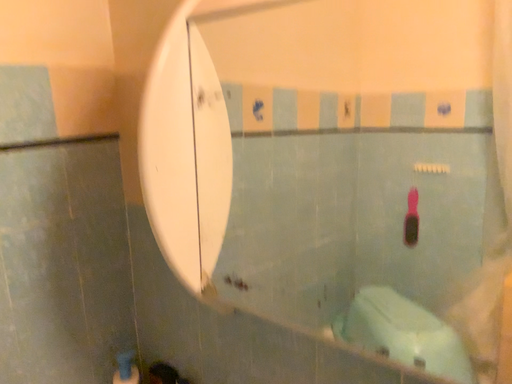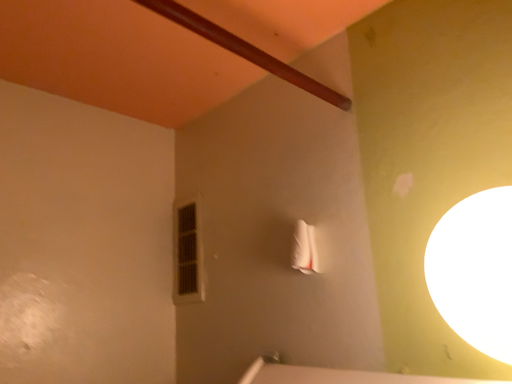
Question: Which way did the camera rotate in the video?

Choices:
 (A) rotated left
 (B) rotated right

Answer: (A)